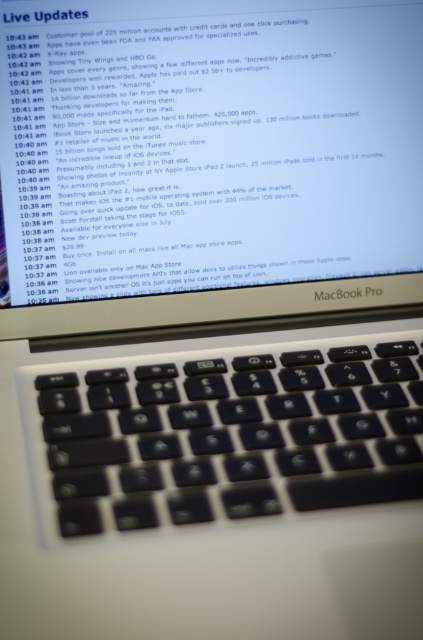
Question: Is matte black macbook pro at center positioned behind black matte keyboard at center?

Choices:
 (A) yes
 (B) no

Answer: (A)

Question: Which point is closer to the camera?

Choices:
 (A) (320, 260)
 (B) (220, 360)

Answer: (B)

Question: Among these points, which one is nearest to the camera?

Choices:
 (A) (392, 380)
 (B) (222, 172)

Answer: (A)

Question: Can you confirm if matte black macbook pro at center is positioned to the left of black matte keyboard at center?

Choices:
 (A) yes
 (B) no

Answer: (A)

Question: Is the position of matte black macbook pro at center more distant than that of black matte keyboard at center?

Choices:
 (A) no
 (B) yes

Answer: (B)

Question: Which point is farther to the camera?

Choices:
 (A) matte black macbook pro at center
 (B) black matte keyboard at center

Answer: (A)